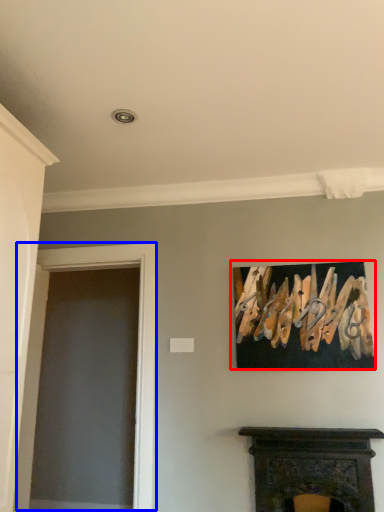
Question: Which object appears closest to the camera in this image, picture frame (highlighted by a red box) or glass door (highlighted by a blue box)?

Choices:
 (A) picture frame
 (B) glass door

Answer: (A)